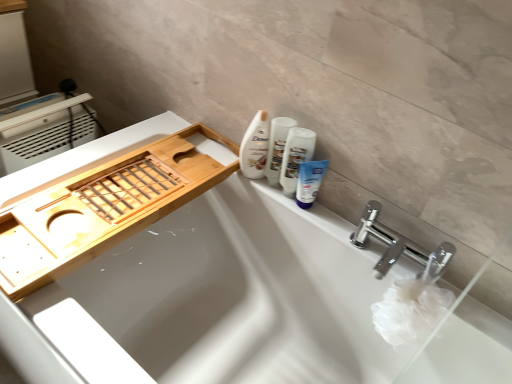
Question: Is blue matte tube at upper right, the second toiletry in the left-to-right sequence, at the right side of white glossy lotion at upper right, the 2th toiletry positioned from the right?

Choices:
 (A) yes
 (B) no

Answer: (A)

Question: From the image's perspective, is blue matte tube at upper right, the second toiletry in the left-to-right sequence, under white glossy lotion at upper right, the 2th toiletry positioned from the right?

Choices:
 (A) yes
 (B) no

Answer: (A)

Question: Is blue matte tube at upper right, the 1th toiletry positioned from the right, facing away from white glossy lotion at upper right, the 2th toiletry positioned from the right?

Choices:
 (A) no
 (B) yes

Answer: (B)

Question: Is blue matte tube at upper right, the second toiletry in the left-to-right sequence, oriented towards white glossy lotion at upper right, the 2th toiletry positioned from the right?

Choices:
 (A) no
 (B) yes

Answer: (A)

Question: Considering the relative positions of blue matte tube at upper right, the 1th toiletry positioned from the right, and white glossy lotion at upper right, arranged as the first toiletry when viewed from the left, in the image provided, is blue matte tube at upper right, the 1th toiletry positioned from the right, to the left of white glossy lotion at upper right, arranged as the first toiletry when viewed from the left, from the viewer's perspective?

Choices:
 (A) yes
 (B) no

Answer: (B)

Question: Considering the relative sizes of blue matte tube at upper right, the second toiletry in the left-to-right sequence, and white glossy lotion at upper right, the 2th toiletry positioned from the right, in the image provided, is blue matte tube at upper right, the second toiletry in the left-to-right sequence, shorter than white glossy lotion at upper right, the 2th toiletry positioned from the right,?

Choices:
 (A) no
 (B) yes

Answer: (B)

Question: Does white glossy bottle at upper center come in front of blue matte tube at upper right, the second toiletry in the left-to-right sequence?

Choices:
 (A) yes
 (B) no

Answer: (B)

Question: Could blue matte tube at upper right, the second toiletry in the left-to-right sequence, be considered to be inside white glossy bottle at upper center?

Choices:
 (A) no
 (B) yes

Answer: (A)

Question: From the image's perspective, is white glossy bottle at upper center under blue matte tube at upper right, the 1th toiletry positioned from the right?

Choices:
 (A) yes
 (B) no

Answer: (B)

Question: Can you confirm if white glossy bottle at upper center is shorter than blue matte tube at upper right, the 1th toiletry positioned from the right?

Choices:
 (A) yes
 (B) no

Answer: (B)

Question: Is white glossy bottle at upper center wider than blue matte tube at upper right, the second toiletry in the left-to-right sequence?

Choices:
 (A) yes
 (B) no

Answer: (A)

Question: Does white glossy bottle at upper center turn towards blue matte tube at upper right, the second toiletry in the left-to-right sequence?

Choices:
 (A) yes
 (B) no

Answer: (B)

Question: Is white glossy tube at upper right surrounding white glossy lotion at upper right, the 2th toiletry positioned from the right?

Choices:
 (A) yes
 (B) no

Answer: (B)